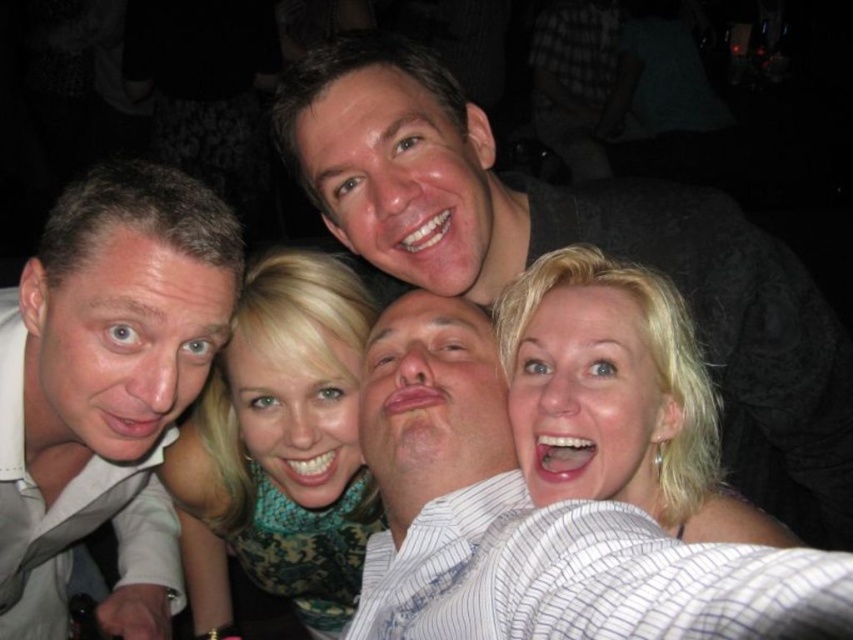
Consider the image. Between light brown shirt at left and blonde hair at center, which one has less height?

Standing shorter between the two is blonde hair at center.

Between point (73, 397) and point (521, 426), which one is positioned behind?

The point (73, 397) is behind.

Find the location of a particular element. This screenshot has height=640, width=853. light brown shirt at left is located at coordinates (106, 387).

Which is more to the right, matte gray shirt at upper center or light brown shirt at left?

From the viewer's perspective, matte gray shirt at upper center appears more on the right side.

Can you confirm if matte gray shirt at upper center is positioned to the left of light brown shirt at left?

In fact, matte gray shirt at upper center is to the right of light brown shirt at left.

You are a GUI agent. You are given a task and a screenshot of the screen. Output one action in this format:
    pyautogui.click(x=<x>, y=<y>)
    Task: Click on the matte gray shirt at upper center
    
    Given the screenshot: What is the action you would take?
    pyautogui.click(x=577, y=241)

What are the coordinates of `matte gray shirt at upper center` in the screenshot? It's located at 577,241.

This screenshot has width=853, height=640. I want to click on teal floral scarf at center, so click(x=280, y=445).

Which of these two, teal floral scarf at center or blonde hair at center, stands taller?

With more height is teal floral scarf at center.

Find the location of a particular element. The height and width of the screenshot is (640, 853). teal floral scarf at center is located at coordinates (280, 445).